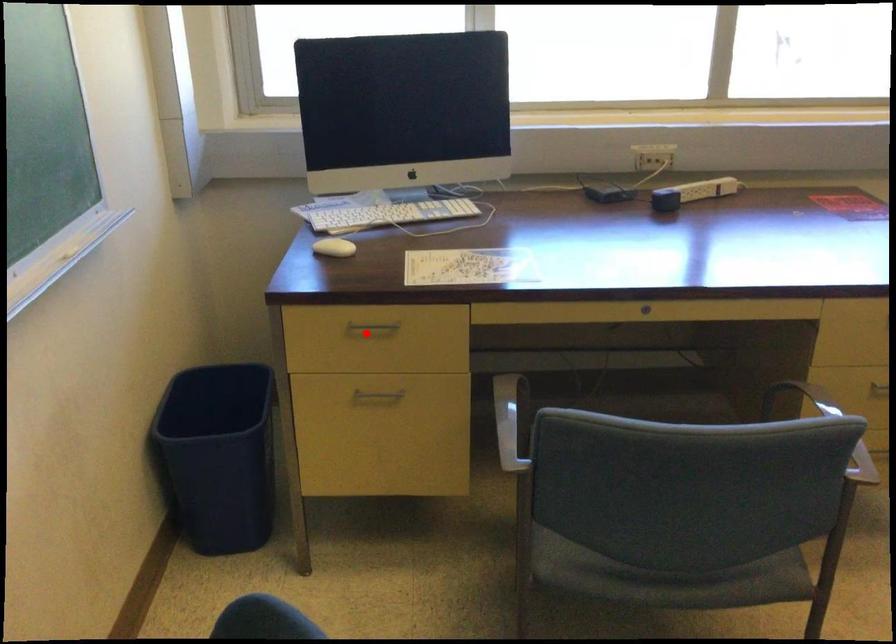
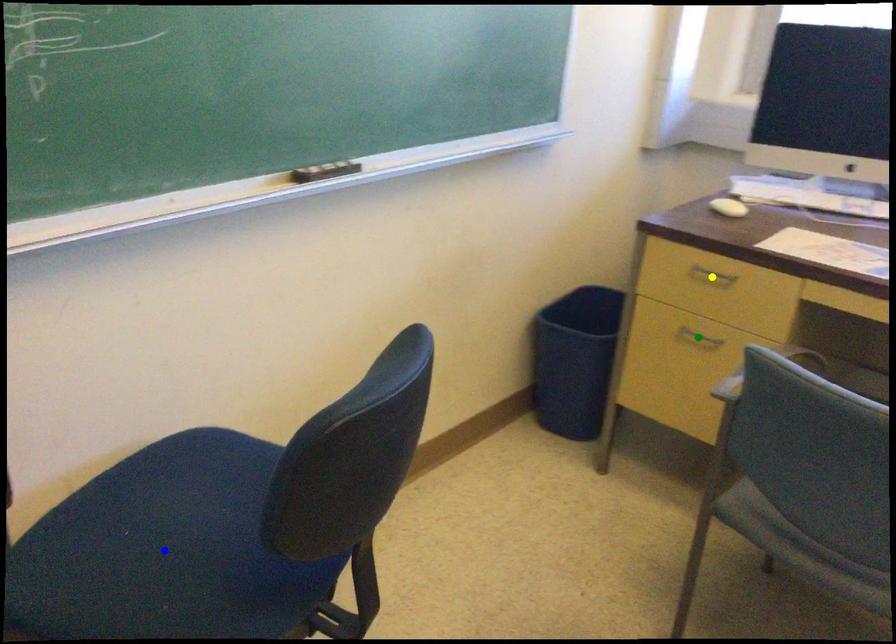
Question: I am providing you with two images of the same scene from different viewpoints. A red point is marked on the first image. You are given multiple points on the second image. Can you choose the point in image 2 that corresponds to the point in image 1?

Choices:
 (A) blue point
 (B) yellow point
 (C) green point

Answer: (B)